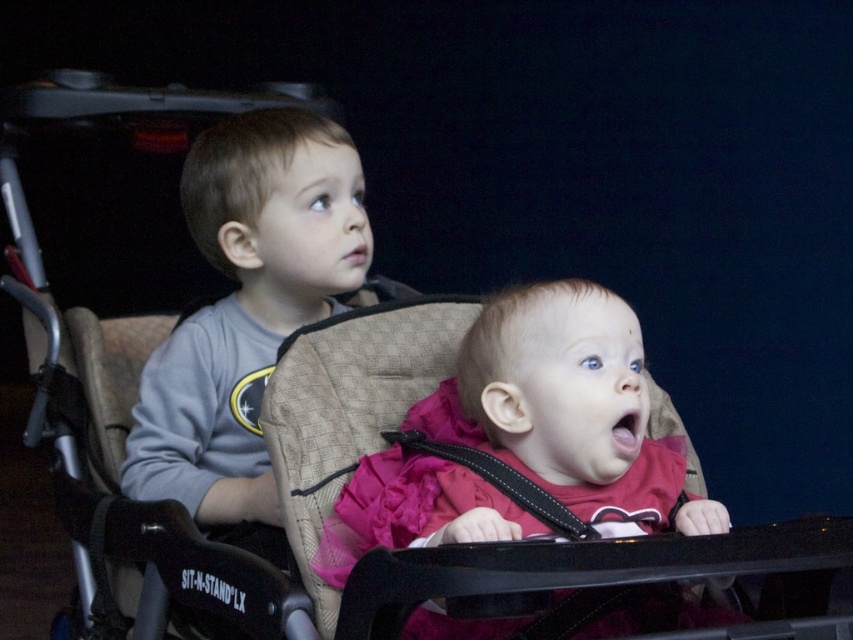
You are a photographer trying to capture a clear photo of the pink satin dress at center and the gray cotton shirt at left. Since the background is dark, you need to adjust your focus. Which object should you focus on first to ensure it appears sharp in the photo?

The pink satin dress at center is in front of the gray cotton shirt at left, so you should focus on the pink satin dress at center first to ensure it appears sharp.

You are a parent pushing a stroller with two children. You notice two points marked on the stroller frame. One is at point (329, 129) and the other at point (529, 481). From your perspective, which point is closer to the front of the stroller?

Point (529, 481) is closer to the front of the stroller because it is in front of point (329, 129).